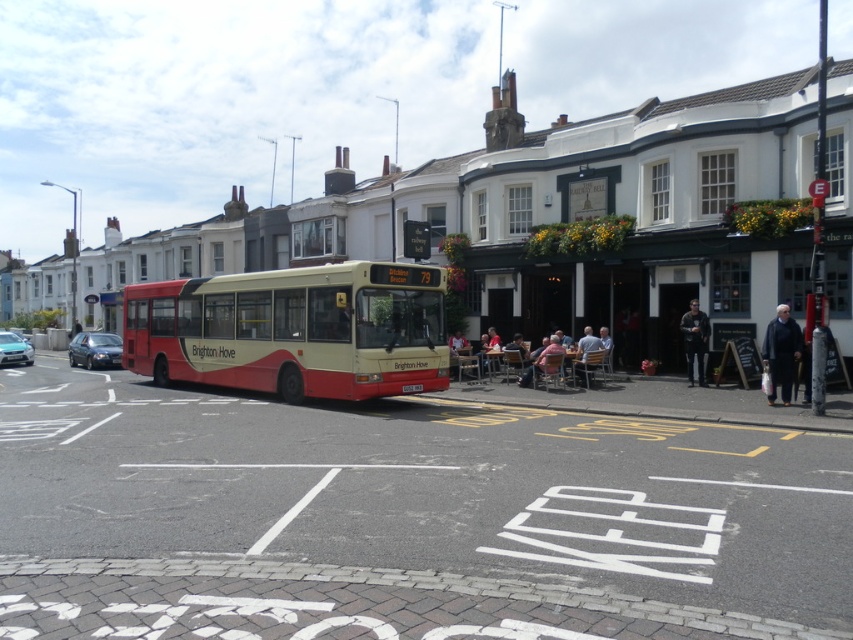
Question: In this image, where is shiny black sedan at left located relative to pink fabric shirt at center?

Choices:
 (A) left
 (B) right

Answer: (A)

Question: Among these objects, which one is farthest from the camera?

Choices:
 (A) light brown wooden chair at center
 (B) light brown wooden table at center

Answer: (A)

Question: Does red matte bus at center appear under light brown wooden chair at center?

Choices:
 (A) yes
 (B) no

Answer: (B)

Question: Considering the real-world distances, which object is farthest from the metallic silver car at left?

Choices:
 (A) dark gray wool coat at lower right
 (B) pink fabric shirt at center
 (C) red matte bus at center
 (D) dark gray jacket at center

Answer: (A)

Question: Which object appears farthest from the camera in this image?

Choices:
 (A) light brown wooden table at center
 (B) dark gray jacket at center
 (C) shiny black sedan at left

Answer: (C)

Question: Is red matte bus at center smaller than metallic silver car at left?

Choices:
 (A) yes
 (B) no

Answer: (B)